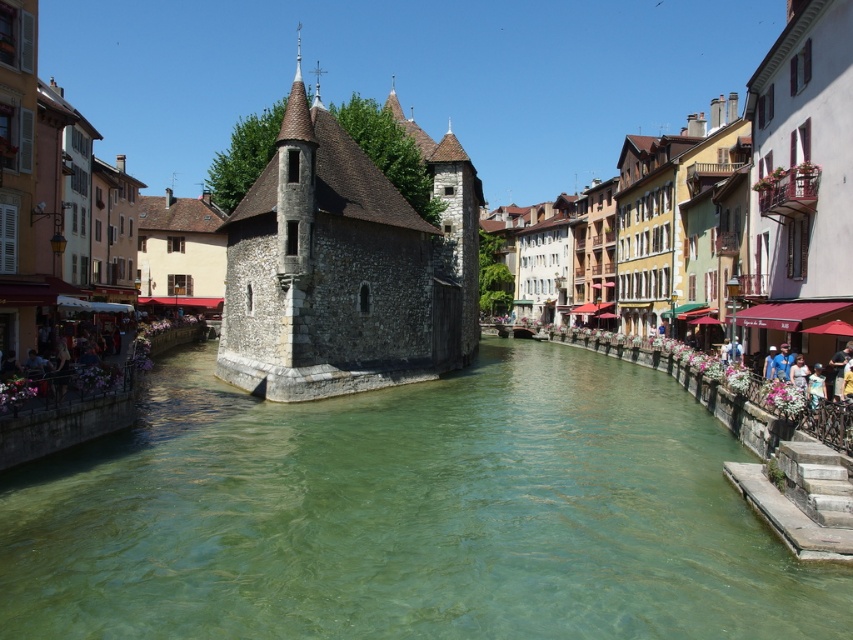
You are a tourist standing on the left bank of the canal. You see the green stone water at center and the stone building at center. Which one is closer to you?

The green stone water at center is closer to you because it is in front of the stone building at center.

You are standing at point (407, 515) in the canal scene. What is the material and location of the object directly beneath your feet?

The object directly beneath your feet at point (407, 515) is green stone water at center.